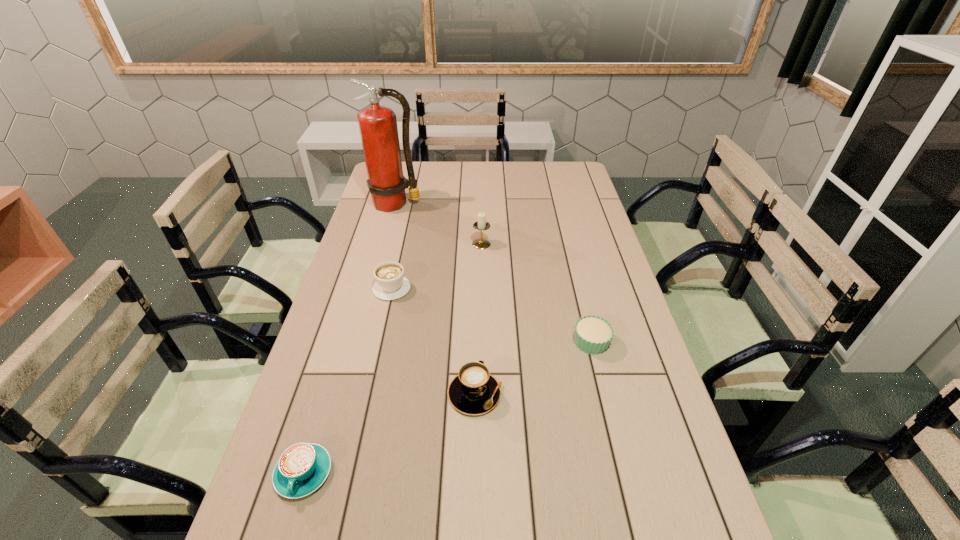
Image resolution: width=960 pixels, height=540 pixels. In order to click on object situated at the right edge in this screenshot , I will do `click(593, 334)`.

The image size is (960, 540). What are the coordinates of `vacant space at the far edge of the desktop` in the screenshot? It's located at (449, 183).

This screenshot has width=960, height=540. What are the coordinates of `free space at the left edge of the desktop` in the screenshot? It's located at (393, 221).

This screenshot has height=540, width=960. Find the location of `free point at the right edge`. free point at the right edge is located at coordinates (625, 391).

Identify the location of free space between the shortest cappuccino and the farthest cappuccino. The width and height of the screenshot is (960, 540). (348, 381).

The width and height of the screenshot is (960, 540). I want to click on vacant space that's between the nearest cappuccino and the second nearest object, so click(x=390, y=434).

Locate an element on the screen. empty space that is in between the farthest object and the nearest object is located at coordinates (349, 339).

The height and width of the screenshot is (540, 960). I want to click on free space between the fire extinguisher and the nearest cappuccino, so click(349, 339).

The width and height of the screenshot is (960, 540). Identify the location of free point between the farthest object and the third farthest object. (394, 246).

You are a GUI agent. You are given a task and a screenshot of the screen. Output one action in this format:
    pyautogui.click(x=<x>, y=<y>)
    Task: Click on the free point between the third farthest object and the tallest object
    
    Given the screenshot: What is the action you would take?
    pyautogui.click(x=394, y=246)